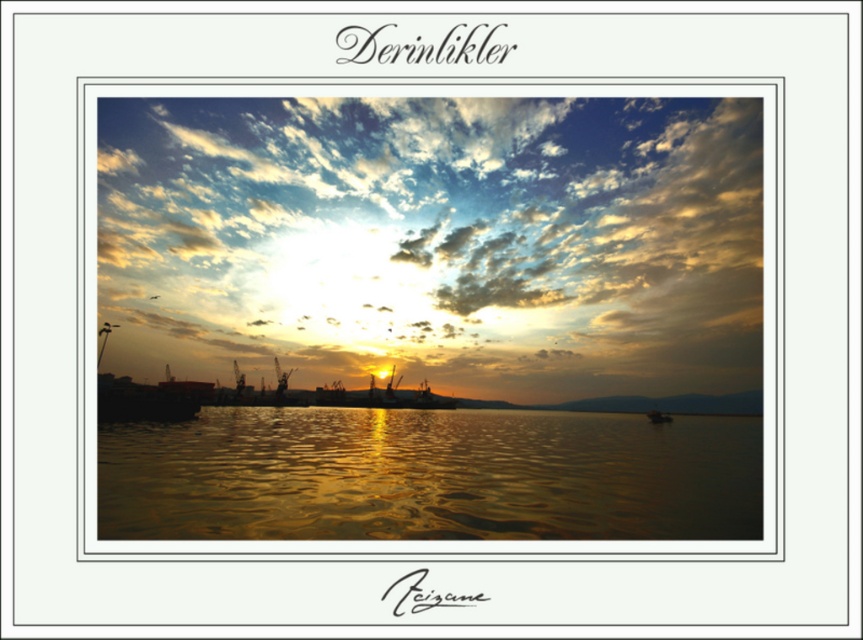
Question: Which point is closer to the camera taking this photo?

Choices:
 (A) (505, 291)
 (B) (402, 534)
 (C) (665, 420)

Answer: (B)

Question: Does cloudy sky at upper center appear on the right side of golden reflective water at center?

Choices:
 (A) yes
 (B) no

Answer: (B)

Question: Which object is positioned closest to the cloudy sky at upper center?

Choices:
 (A) golden reflective water at center
 (B) metallic silver boat at center

Answer: (B)

Question: Can you confirm if cloudy sky at upper center is positioned to the left of golden reflective water at center?

Choices:
 (A) no
 (B) yes

Answer: (B)

Question: Is cloudy sky at upper center below golden reflective water at center?

Choices:
 (A) yes
 (B) no

Answer: (B)

Question: Which point is farther to the camera?

Choices:
 (A) golden reflective water at center
 (B) cloudy sky at upper center
 (C) metallic silver boat at center

Answer: (B)